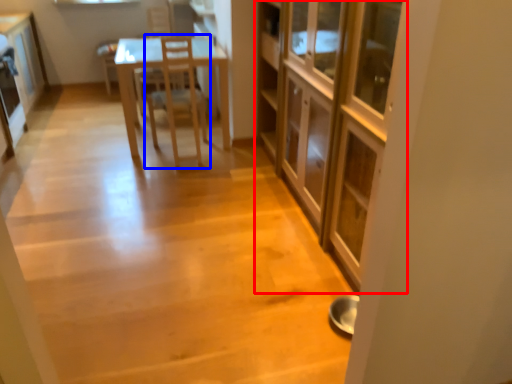
Question: Which object appears farthest to the camera in this image, cabinetry (highlighted by a red box) or chair (highlighted by a blue box)?

Choices:
 (A) cabinetry
 (B) chair

Answer: (B)